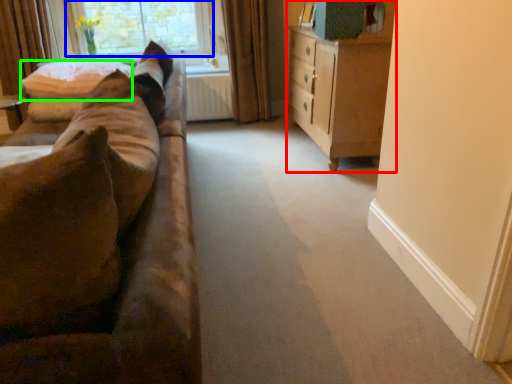
Question: Which object is positioned closest to cabinetry (highlighted by a red box)? Select from window (highlighted by a blue box) and pillow (highlighted by a green box).

Choices:
 (A) window
 (B) pillow

Answer: (B)